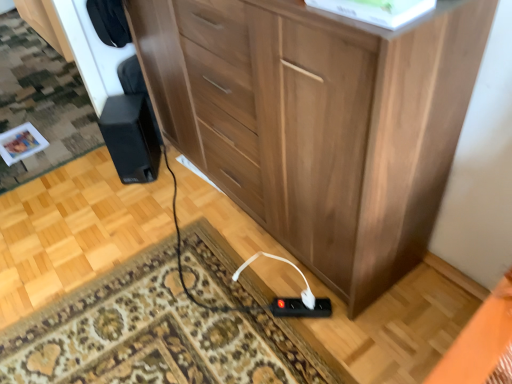
Find the location of `blank space to the left of black matte speaker at lower left`. blank space to the left of black matte speaker at lower left is located at coordinates (97, 179).